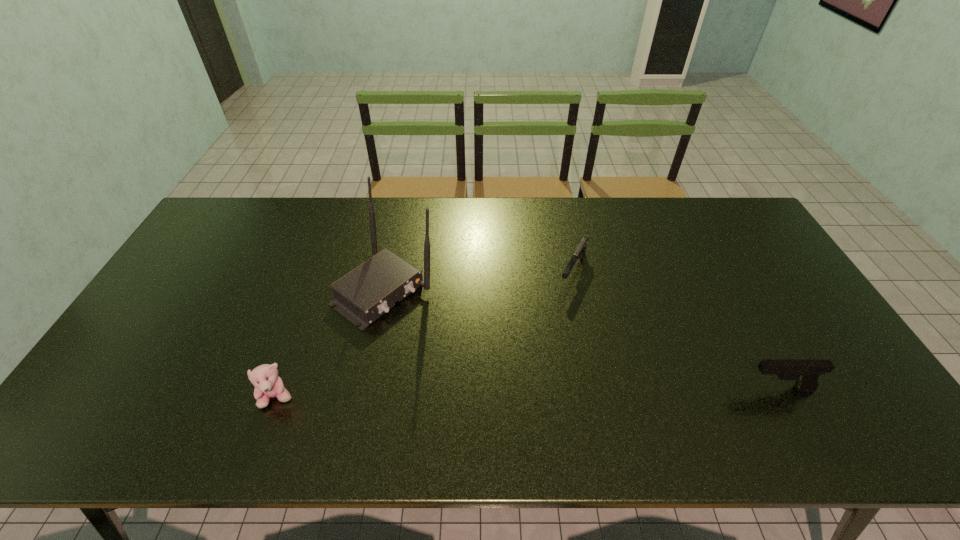
The width and height of the screenshot is (960, 540). Identify the location of free space at the left edge of the desktop. (190, 330).

The image size is (960, 540). In the image, there is a desktop. What are the coordinates of `vacant region at the right edge` in the screenshot? It's located at (780, 325).

Locate an element on the screen. The image size is (960, 540). free space at the far left corner is located at coordinates (235, 213).

Locate an element on the screen. The image size is (960, 540). free space between the teddy bear and the third object from right to left is located at coordinates 331,343.

At what (x,y) coordinates should I click in order to perform the action: click on vacant space that is in between the router and the pistol. Please return your answer as a coordinate pair (x, y). The height and width of the screenshot is (540, 960). Looking at the image, I should click on (582, 339).

Where is `free space between the third object from left to right and the rightmost object`? The width and height of the screenshot is (960, 540). free space between the third object from left to right and the rightmost object is located at coordinates (676, 329).

This screenshot has width=960, height=540. Identify the location of free space between the teddy bear and the rightmost object. (528, 393).

In order to click on free space between the tallest object and the gun in this screenshot , I will do `click(479, 280)`.

Locate an element on the screen. This screenshot has height=540, width=960. free space between the pistol and the gun is located at coordinates (676, 329).

You are a GUI agent. You are given a task and a screenshot of the screen. Output one action in this format:
    pyautogui.click(x=<x>, y=<y>)
    Task: Click on the vacant space in between the gun and the rightmost object
    
    Given the screenshot: What is the action you would take?
    pyautogui.click(x=676, y=329)